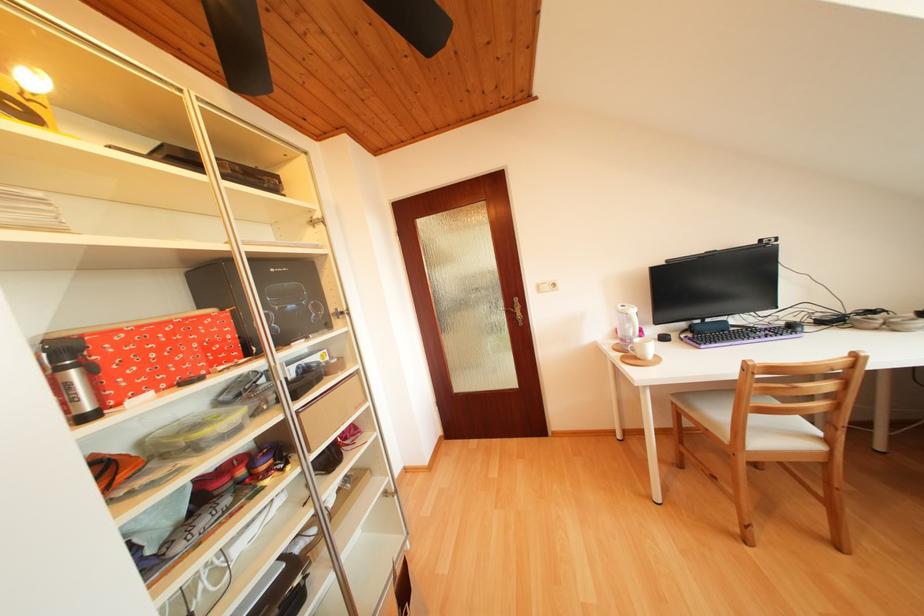
Where is `power outlet`? The width and height of the screenshot is (924, 616). power outlet is located at coordinates (545, 286).